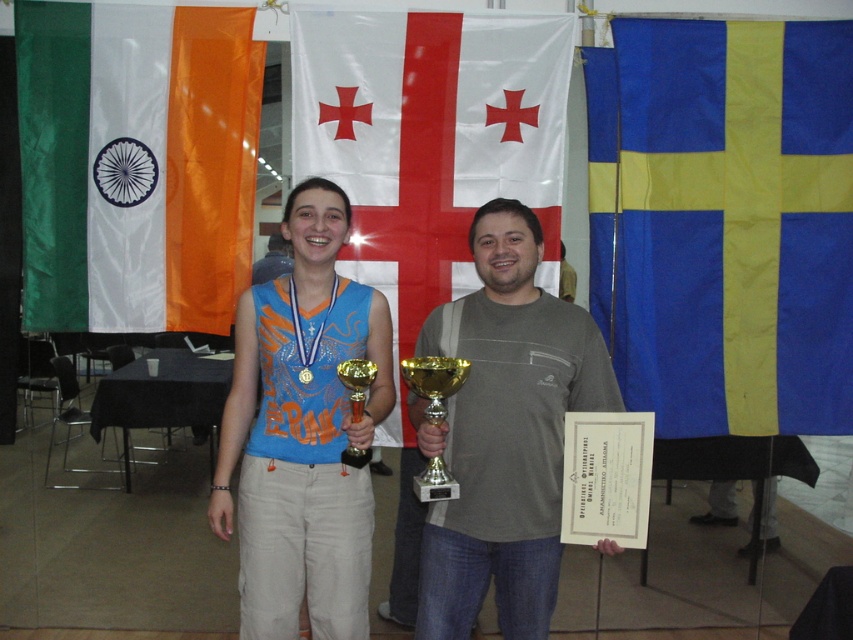
Based on the photo, you are standing in the room and want to determine which of the two points, point (183, 33) or point (534, 449), is closer to you. Based on the scene description, which point is nearer?

Point (183, 33) is further to the viewer than point (534, 449).

You are a photographer setting up for a group photo. You need to ensure that the greensilky fabricflag at left and the gold metallic trophy at center are both visible in the frame. Based on their positions and sizes, which object might require you to adjust your camera angle more to include it in the shot?

The greensilky fabricflag at left might be wider than the gold metallic trophy at center, so it could require a wider camera angle to ensure it fits into the frame.

You are an event photographer and need to capture a closeup of the greensilky fabricflag at left. Based on its position, where should you aim your camera?

The greensilky fabricflag at left is located at the 2D coordinates point (136, 164), so you should aim your camera at that position to capture it in focus.